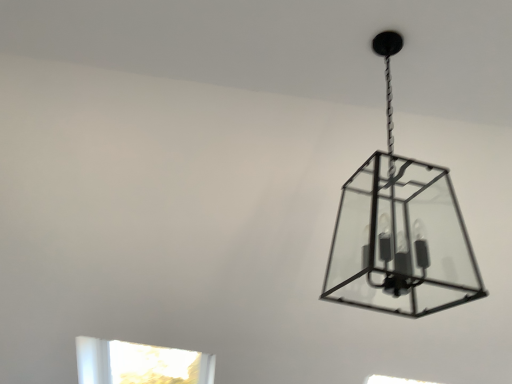
What do you see at coordinates (400, 231) in the screenshot? I see `clear glass lantern at upper center` at bounding box center [400, 231].

The width and height of the screenshot is (512, 384). In order to click on clear glass lantern at upper center in this screenshot , I will do `click(400, 231)`.

Where is `clear glass lantern at upper center`? The height and width of the screenshot is (384, 512). clear glass lantern at upper center is located at coordinates (400, 231).